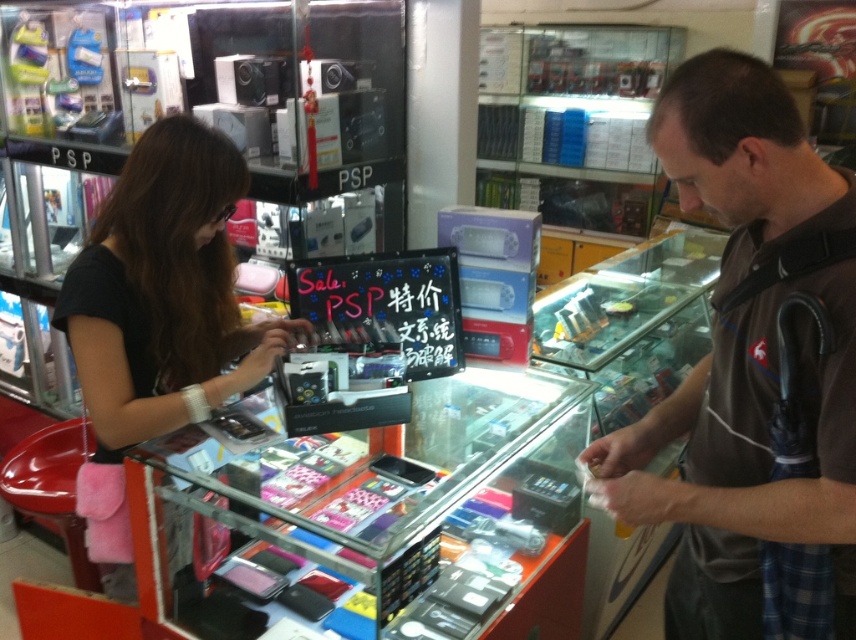
In the scene shown: Is brown cotton shirt at center shorter than black matte purse at left?

Yes.

Does brown cotton shirt at center appear on the right side of black matte purse at left?

Indeed, brown cotton shirt at center is positioned on the right side of black matte purse at left.

Where is `brown cotton shirt at center`? brown cotton shirt at center is located at coordinates (753, 372).